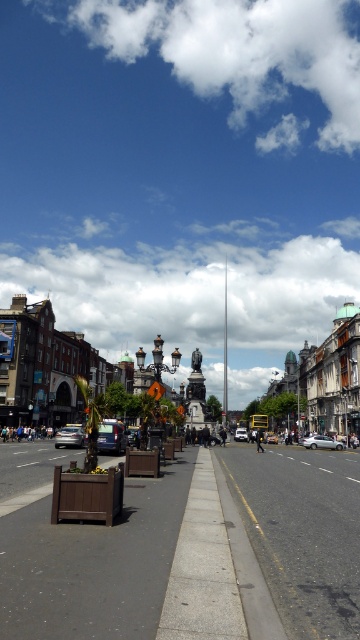
Who is more forward, [55,442] or [234,435]?

Point [55,442] is in front.

Can you confirm if matte black car at center is smaller than silver metallic car at center?

Yes.

At what (x,y) coordinates should I click in order to perform the action: click on matte black car at center. Please return your answer as a coordinate pair (x, y). Image resolution: width=360 pixels, height=640 pixels. Looking at the image, I should click on (69, 436).

This screenshot has width=360, height=640. Identify the location of matte black car at center. (69, 436).

Who is positioned more to the right, silver metallic car at center-right or silver metallic car at center?

Positioned to the right is silver metallic car at center-right.

Between silver metallic car at center-right and silver metallic car at center, which one is positioned lower?

silver metallic car at center is lower down.

What do you see at coordinates (321, 442) in the screenshot? This screenshot has width=360, height=640. I see `silver metallic car at center-right` at bounding box center [321, 442].

You are a GUI agent. You are given a task and a screenshot of the screen. Output one action in this format:
    pyautogui.click(x=<x>, y=<y>)
    Task: Click on the silver metallic car at center-right
    
    Given the screenshot: What is the action you would take?
    pyautogui.click(x=321, y=442)

Is point (109, 451) closer to camera compared to point (272, 440)?

That is True.

This screenshot has height=640, width=360. Identify the location of metallic silver car at left. (111, 436).